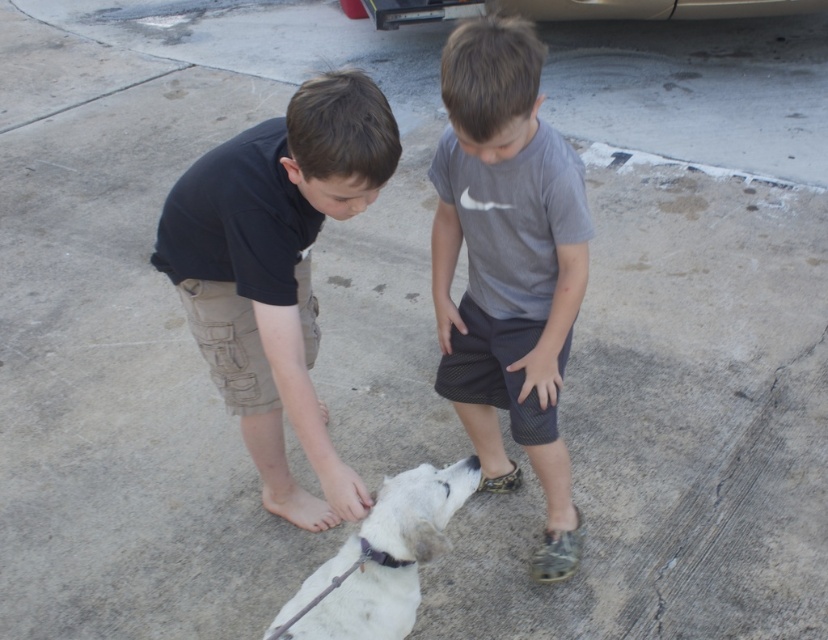
Can you confirm if dark blue cotton shirt at center is positioned to the right of white fur paw at lower center?

No, dark blue cotton shirt at center is not to the right of white fur paw at lower center.

Describe the element at coordinates (272, 250) in the screenshot. The width and height of the screenshot is (828, 640). I see `dark blue cotton shirt at center` at that location.

Where is `dark blue cotton shirt at center`? The image size is (828, 640). dark blue cotton shirt at center is located at coordinates (272, 250).

Where is `dark blue cotton shirt at center`? This screenshot has width=828, height=640. dark blue cotton shirt at center is located at coordinates (272, 250).

Between point (207, 202) and point (354, 588), which one is positioned behind?

The point (207, 202) is more distant.

Does point (272, 371) lie behind point (388, 529)?

Yes, it is behind point (388, 529).

The image size is (828, 640). What are the coordinates of `dark blue cotton shirt at center` in the screenshot? It's located at (272, 250).

Who is shorter, gray cotton shirt at center or white matte dog at lower center?

white matte dog at lower center is shorter.

Is point (453, 92) closer to camera compared to point (436, 513)?

No, it is behind (436, 513).

Which is behind, point (506, 467) or point (434, 525)?

Positioned behind is point (506, 467).

In order to click on gray cotton shirt at center in this screenshot , I will do `click(508, 266)`.